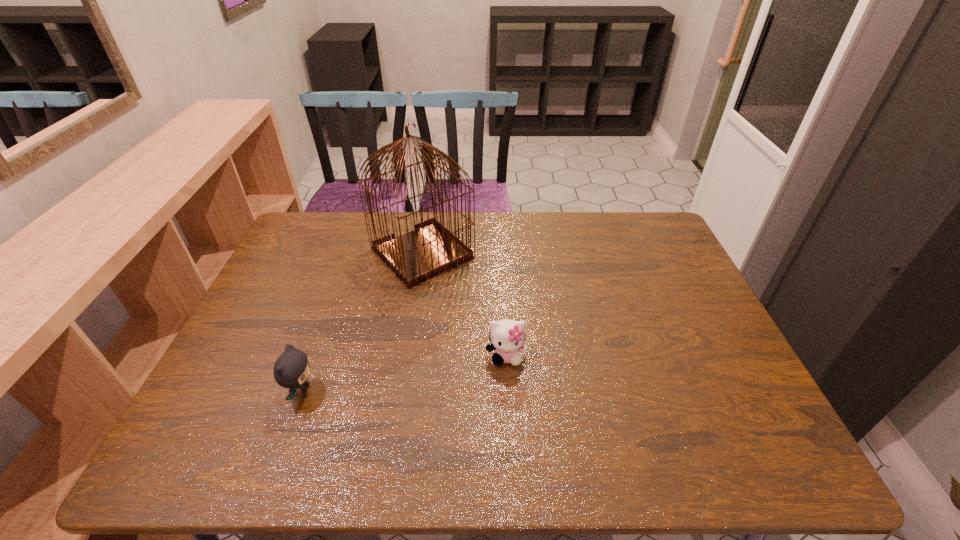
You are a GUI agent. You are given a task and a screenshot of the screen. Output one action in this format:
    pyautogui.click(x=<x>, y=<y>)
    Task: Click on the vacant area at the left edge
    Image resolution: width=960 pixels, height=540 pixels.
    Given the screenshot: What is the action you would take?
    pyautogui.click(x=319, y=285)

In order to click on vacant space at the right edge of the desktop in this screenshot , I will do `click(742, 406)`.

The height and width of the screenshot is (540, 960). I want to click on free space that is in between the right kitten and the birdcage, so click(x=465, y=305).

Find the location of `vacant area that lies between the tallest object and the leftmost object`. vacant area that lies between the tallest object and the leftmost object is located at coordinates (362, 322).

You are a GUI agent. You are given a task and a screenshot of the screen. Output one action in this format:
    pyautogui.click(x=<x>, y=<y>)
    Task: Click on the unoccupied area between the right kitten and the farthest object
    The height and width of the screenshot is (540, 960).
    Given the screenshot: What is the action you would take?
    pyautogui.click(x=465, y=305)

Where is `unoccupied position between the second object from left to right and the rightmost object`? unoccupied position between the second object from left to right and the rightmost object is located at coordinates (465, 305).

Identify the location of free space between the tallest object and the right kitten. This screenshot has width=960, height=540. (465, 305).

Where is `free space between the second object from left to right and the leftmost object`? This screenshot has width=960, height=540. free space between the second object from left to right and the leftmost object is located at coordinates (362, 322).

Locate an element on the screen. This screenshot has height=540, width=960. vacant area that lies between the leftmost object and the tallest object is located at coordinates (362, 322).

Where is `blank region between the leftmost object and the right kitten`? blank region between the leftmost object and the right kitten is located at coordinates (404, 374).